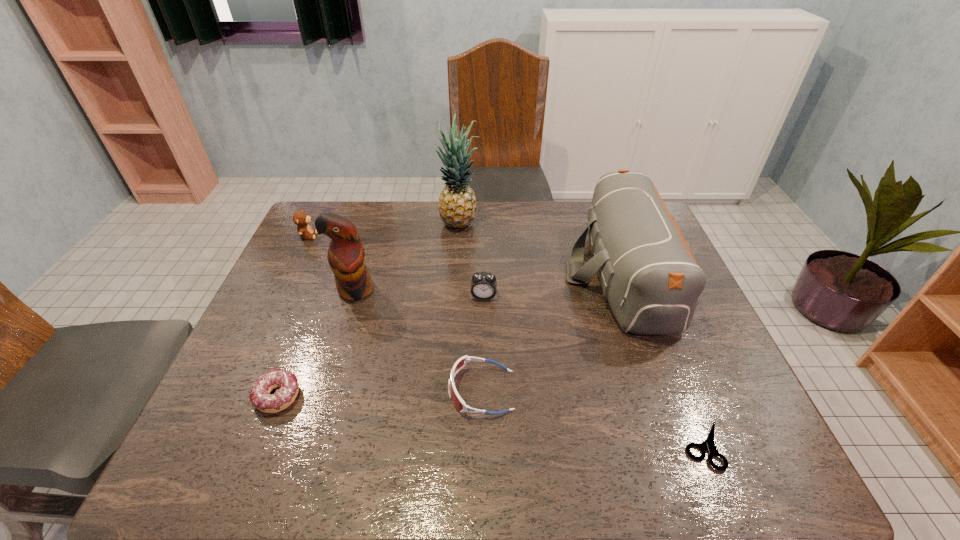
What are the coordinates of `vacant point located 0.180m on the face of the parrot` in the screenshot? It's located at (333, 360).

At what (x,y) coordinates should I click in order to perform the action: click on vacant space located 0.080m on the back of the duffel bag. Please return your answer as a coordinate pair (x, y). Looking at the image, I should click on (597, 206).

Identify the location of vacant space positioned on the face of the leftmost object. Image resolution: width=960 pixels, height=540 pixels. (440, 236).

You are a GUI agent. You are given a task and a screenshot of the screen. Output one action in this format:
    pyautogui.click(x=<x>, y=<y>)
    Task: Click on the free point located on the front side of the alarm clock
    The height and width of the screenshot is (540, 960).
    Given the screenshot: What is the action you would take?
    pyautogui.click(x=484, y=374)

The height and width of the screenshot is (540, 960). Identify the location of vacant space located on the front-facing side of the goggles. (368, 390).

In order to click on free location located on the front-facing side of the goggles in this screenshot , I will do `click(336, 390)`.

Locate an element on the screen. blank area located 0.400m on the front-facing side of the goggles is located at coordinates (269, 390).

At what (x,y) coordinates should I click in order to perform the action: click on vacant space located on the right of the doughnut. Please return your answer as a coordinate pair (x, y). This screenshot has height=540, width=960. Looking at the image, I should click on (438, 396).

Locate an element on the screen. free space located on the left of the shortest object is located at coordinates (649, 446).

Where is `pineapple that is at the far edge`? This screenshot has width=960, height=540. pineapple that is at the far edge is located at coordinates (457, 202).